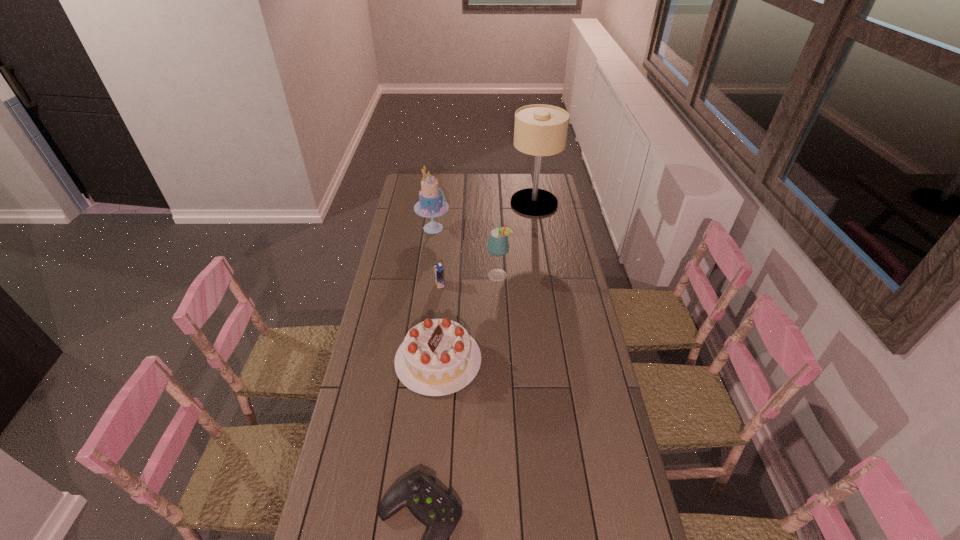
This screenshot has height=540, width=960. Find the location of `vacant space that satisfies the following two spatial constraints: 1. with a ladder on the side of the birthday cake; 2. on the left side of the cake`. vacant space that satisfies the following two spatial constraints: 1. with a ladder on the side of the birthday cake; 2. on the left side of the cake is located at coordinates (416, 360).

Locate an element on the screen. blank space that satisfies the following two spatial constraints: 1. with a ladder on the side of the orange_juice; 2. on the right side of the second farthest object is located at coordinates (425, 284).

This screenshot has width=960, height=540. In order to click on free location that satisfies the following two spatial constraints: 1. with a ladder on the side of the alcohol; 2. on the right side of the fifth nearest object in this screenshot , I will do `click(427, 275)`.

The width and height of the screenshot is (960, 540). I want to click on blank area in the image that satisfies the following two spatial constraints: 1. on the back side of the alcohol; 2. on the right side of the fourth tallest object, so (445, 275).

You are a GUI agent. You are given a task and a screenshot of the screen. Output one action in this format:
    pyautogui.click(x=<x>, y=<y>)
    Task: Click on the vacant space that satisfies the following two spatial constraints: 1. with a ladder on the side of the second object from right to left; 2. on the right side of the cake
    The image size is (960, 540).
    Given the screenshot: What is the action you would take?
    pyautogui.click(x=427, y=275)